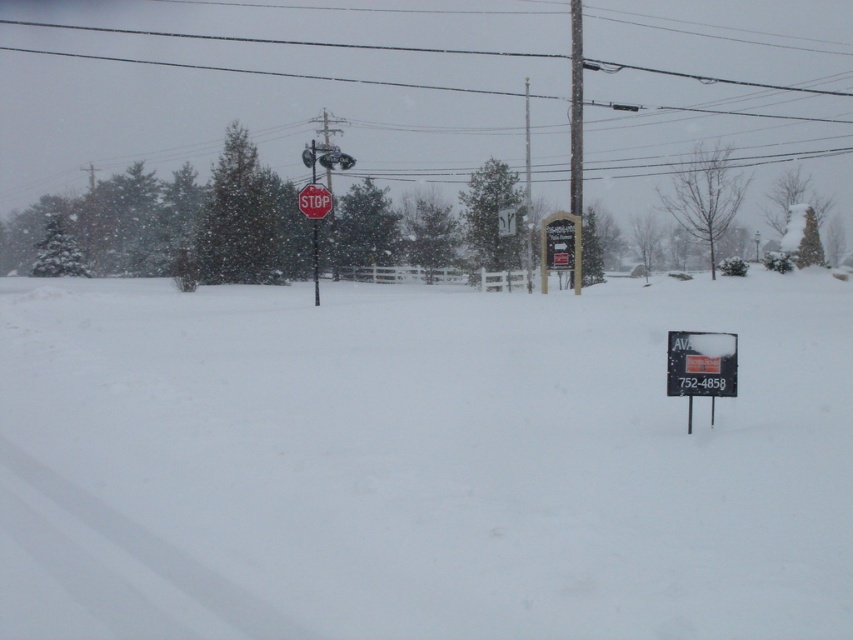
Is metallic wire at upper center to the right of black plastic sign at lower right from the viewer's perspective?

In fact, metallic wire at upper center is to the left of black plastic sign at lower right.

Is metallic wire at upper center above black plastic sign at lower right?

Yes, metallic wire at upper center is above black plastic sign at lower right.

Where is `metallic wire at upper center`? This screenshot has height=640, width=853. metallic wire at upper center is located at coordinates (283, 88).

Looking at this image, is white powdery snow at center closer to camera compared to metallic wire at upper center?

That is True.

Is white powdery snow at center taller than metallic wire at upper center?

In fact, white powdery snow at center may be shorter than metallic wire at upper center.

Where is `white powdery snow at center`? white powdery snow at center is located at coordinates (430, 460).

What do you see at coordinates (430, 460) in the screenshot? This screenshot has width=853, height=640. I see `white powdery snow at center` at bounding box center [430, 460].

Between point (552, 400) and point (306, 188), which one is positioned in front?

Positioned in front is point (552, 400).

Identify the location of white powdery snow at center. The height and width of the screenshot is (640, 853). coord(430,460).